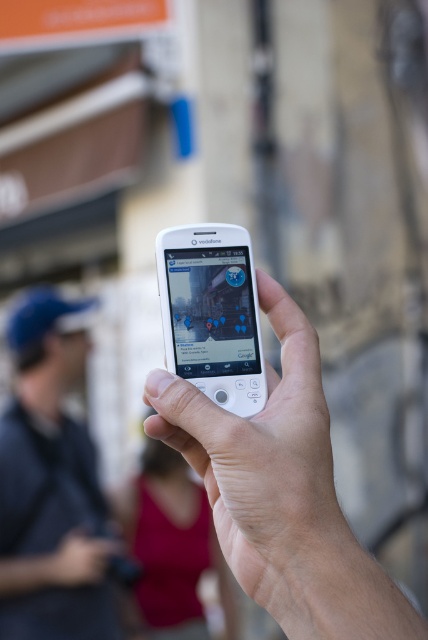
Looking at this image, does white matte phone at center appear on the left side of white matte ipod at center?

In fact, white matte phone at center is to the right of white matte ipod at center.

Which is above, white matte phone at center or white matte ipod at center?

white matte ipod at center is higher up.

Find the location of a particular element. The height and width of the screenshot is (640, 428). white matte phone at center is located at coordinates (267, 472).

Where is `white matte phone at center`? This screenshot has height=640, width=428. white matte phone at center is located at coordinates [267, 472].

Can you confirm if blue fabric cap at left is positioned above white matte ipod at center?

Incorrect, blue fabric cap at left is not positioned above white matte ipod at center.

Is blue fabric cap at left smaller than white matte ipod at center?

Incorrect, blue fabric cap at left is not smaller in size than white matte ipod at center.

Identify the location of blue fabric cap at left. The width and height of the screenshot is (428, 640). (50, 484).

Who is lower down, white matte phone at center or blue fabric cap at left?

Positioned lower is blue fabric cap at left.

Which is more to the left, white matte phone at center or blue fabric cap at left?

blue fabric cap at left is more to the left.

Which is behind, point (351, 536) or point (86, 545)?

Point (86, 545)

Identify the location of white matte phone at center. (267, 472).